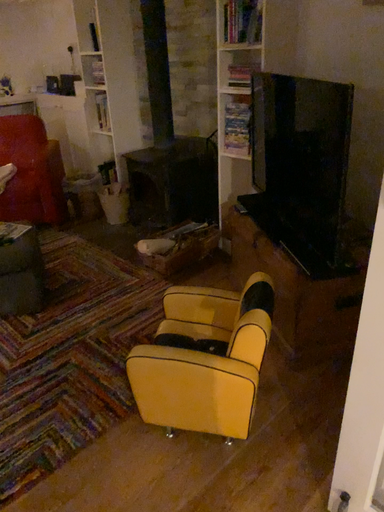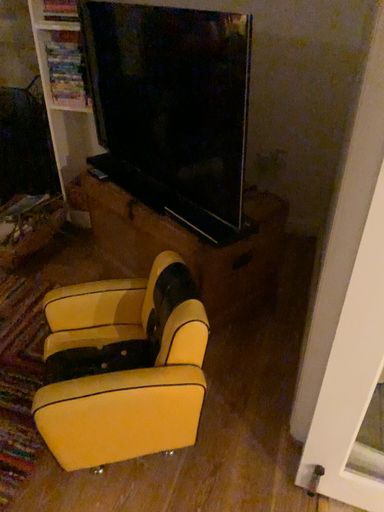
Question: How did the camera likely rotate when shooting the video?

Choices:
 (A) rotated right
 (B) rotated left

Answer: (A)